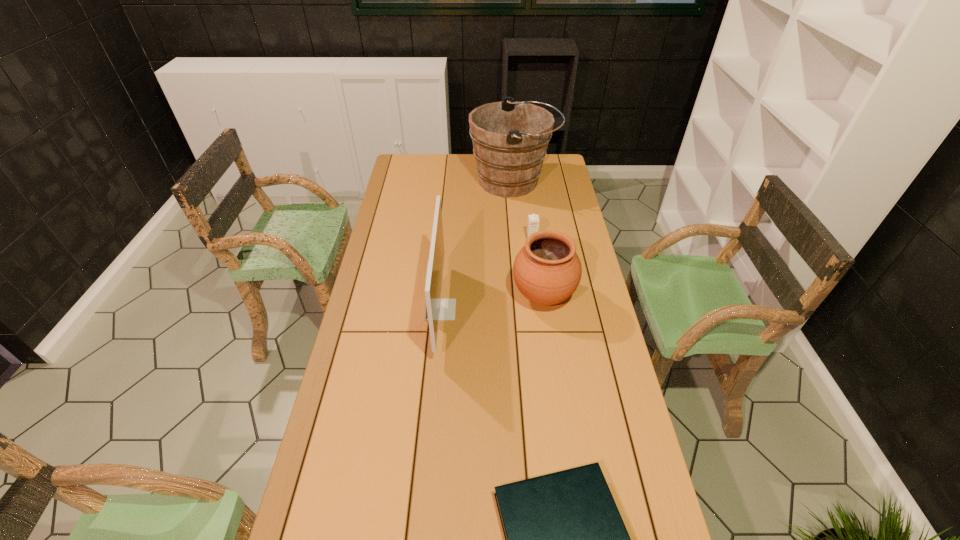
Identify which object is located as the second nearest to the book. Please provide its 2D coordinates. Your answer should be formatted as a tuple, i.e. [(x, y)], where the tuple contains the x and y coordinates of a point satisfying the conditions above.

[(547, 270)]